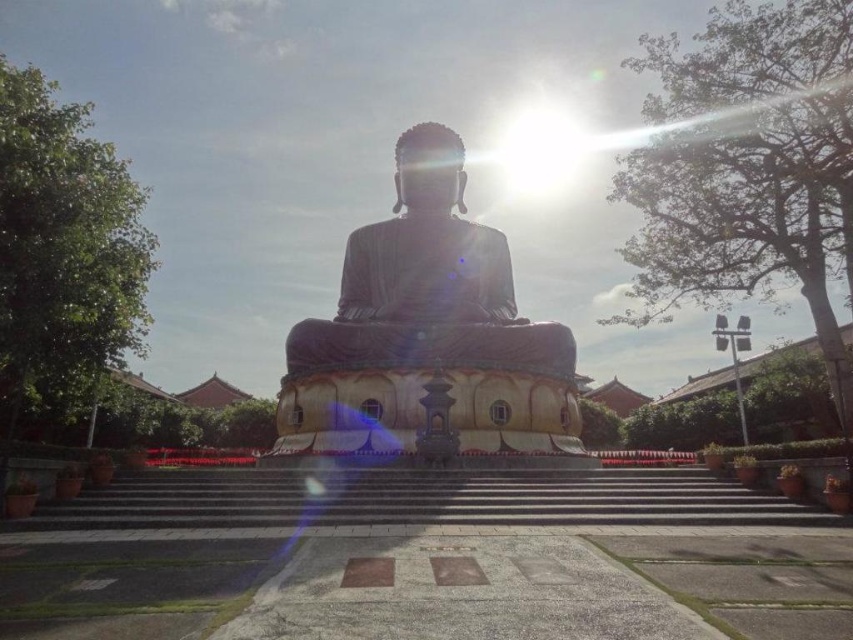
Question: Where is dark gray concrete stairs at center located in relation to satin gold statue at center in the image?

Choices:
 (A) left
 (B) right

Answer: (B)

Question: Which object appears farthest from the camera in this image?

Choices:
 (A) satin gold statue at center
 (B) dark gray concrete stairs at center

Answer: (A)

Question: Where is black polished stone statue at center located in relation to satin gold statue at center in the image?

Choices:
 (A) above
 (B) below

Answer: (B)

Question: Is black polished stone statue at center smaller than satin gold statue at center?

Choices:
 (A) yes
 (B) no

Answer: (B)

Question: Among these objects, which one is nearest to the camera?

Choices:
 (A) dark gray concrete stairs at center
 (B) black polished stone statue at center

Answer: (A)

Question: Which of the following is the farthest from the observer?

Choices:
 (A) dark gray concrete stairs at center
 (B) black polished stone statue at center
 (C) satin gold statue at center

Answer: (C)